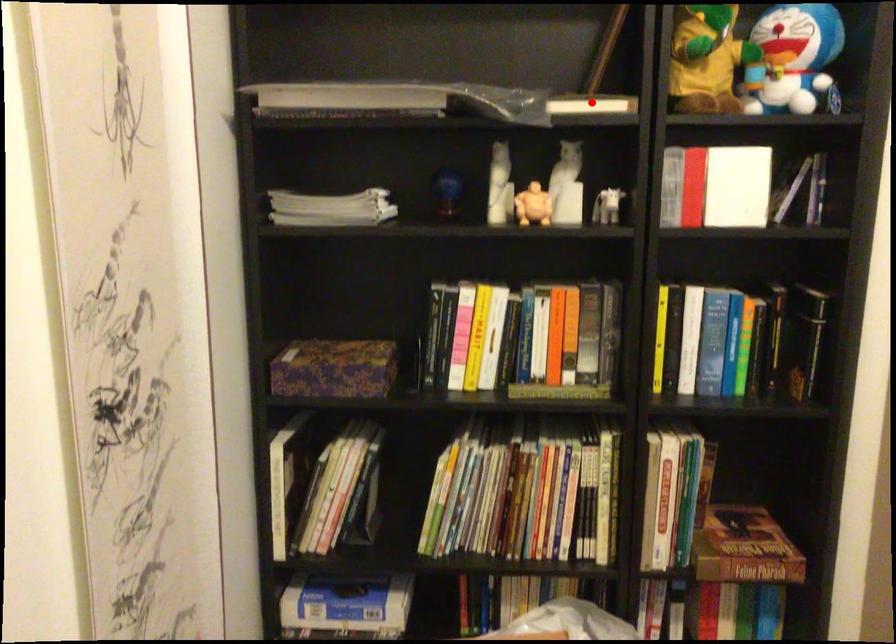
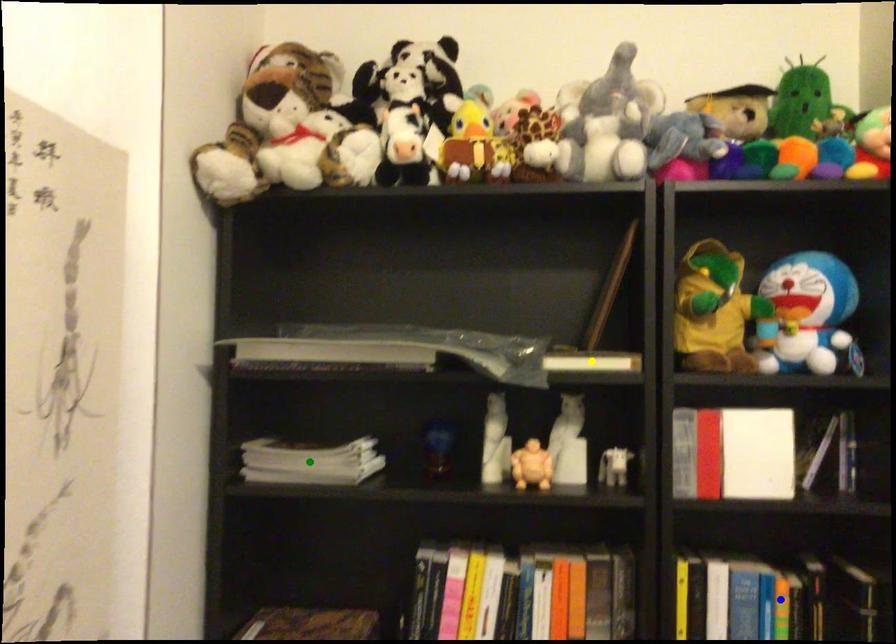
Question: I am providing you with two images of the same scene from different viewpoints. A red point is marked on the first image. You are given multiple points on the second image. Which mark in image 2 goes with the point in image 1?

Choices:
 (A) blue point
 (B) yellow point
 (C) green point

Answer: (B)